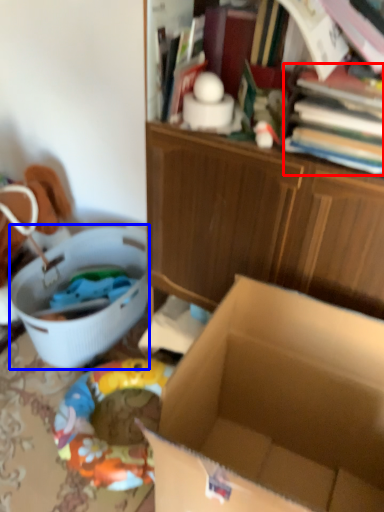
Question: Which object appears closest to the camera in this image, book (highlighted by a red box) or laundry basket (highlighted by a blue box)?

Choices:
 (A) book
 (B) laundry basket

Answer: (A)